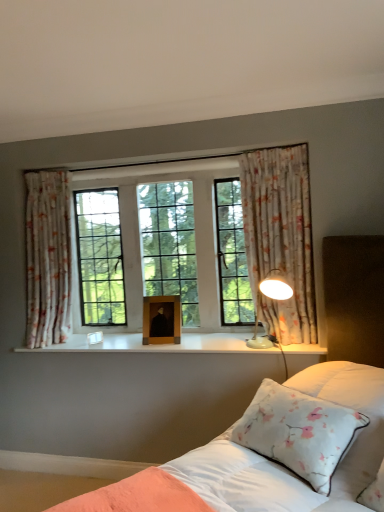
Question: Which is correct: floral fabric curtain at left, placed as the 2th curtain when sorted from right to left, is inside white glossy wood at center, or outside of it?

Choices:
 (A) outside
 (B) inside

Answer: (A)

Question: Is floral fabric curtain at left, placed as the 1th curtain when sorted from left to right, wider or thinner than white glossy wood at center?

Choices:
 (A) thin
 (B) wide

Answer: (A)

Question: Which is farther from the floral fabric curtain at right, which ranks as the 2th curtain in back-to-front order?

Choices:
 (A) white floral pillow at lower right
 (B) wooden picture frame at center
 (C) white satin bed at center
 (D) floral fabric curtain at left, which is the second curtain in front-to-back order
 (E) white glossy wood at center

Answer: (D)

Question: Based on their relative distances, which object is farther from the white glossy table lamp at right?

Choices:
 (A) white satin bed at center
 (B) white glossy wood at center
 (C) floral fabric curtain at left, placed as the 2th curtain when sorted from right to left
 (D) wooden picture frame at center
 (E) white floral pillow at lower right

Answer: (C)